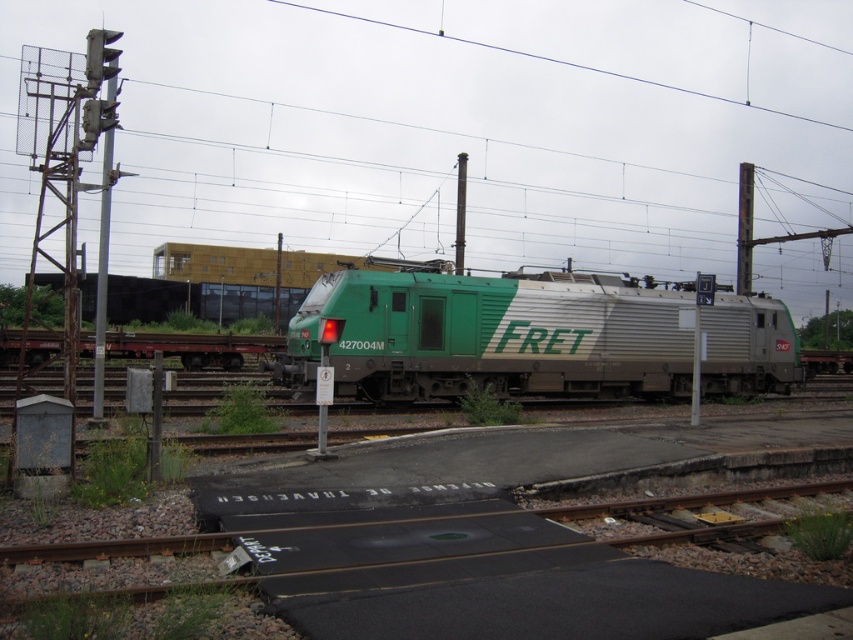
You are a railway worker standing at the smooth metallic pole at center. You need to inspect the green metallic freight locomotive at center. In which direction should you walk to reach it?

The green metallic freight locomotive at center is to the right of the smooth metallic pole at center, so you should walk to the right to reach it.

You are standing at the railway station and see two points marked on the tracks. Which point is closer to you, point (474, 365) or point (461, 221)?

Point (474, 365) is closer to the viewer than point (461, 221).